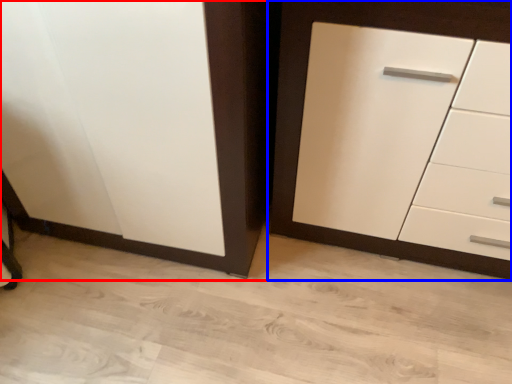
Question: Which point is closer to the camera, cupboard (highlighted by a red box) or chest of drawers (highlighted by a blue box)?

Choices:
 (A) cupboard
 (B) chest of drawers

Answer: (B)